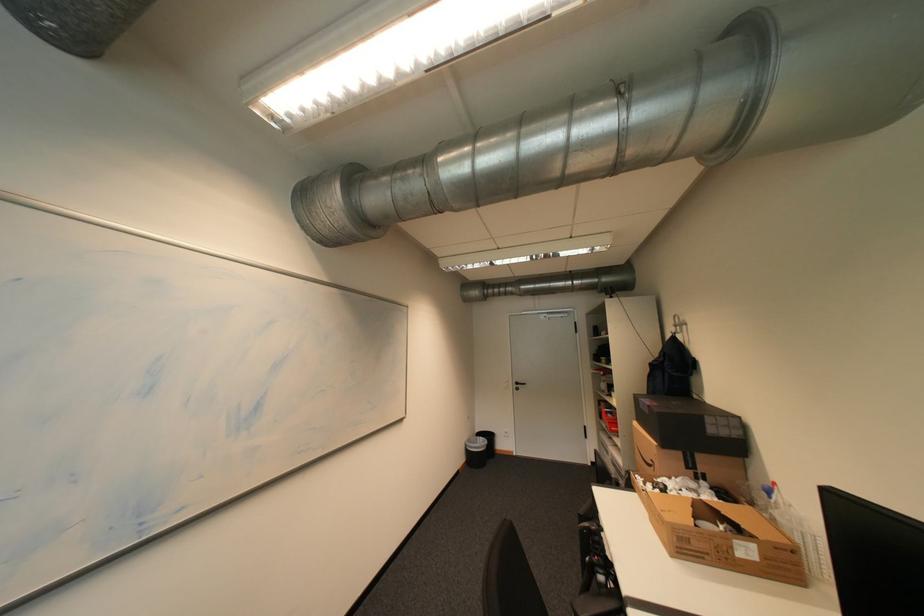
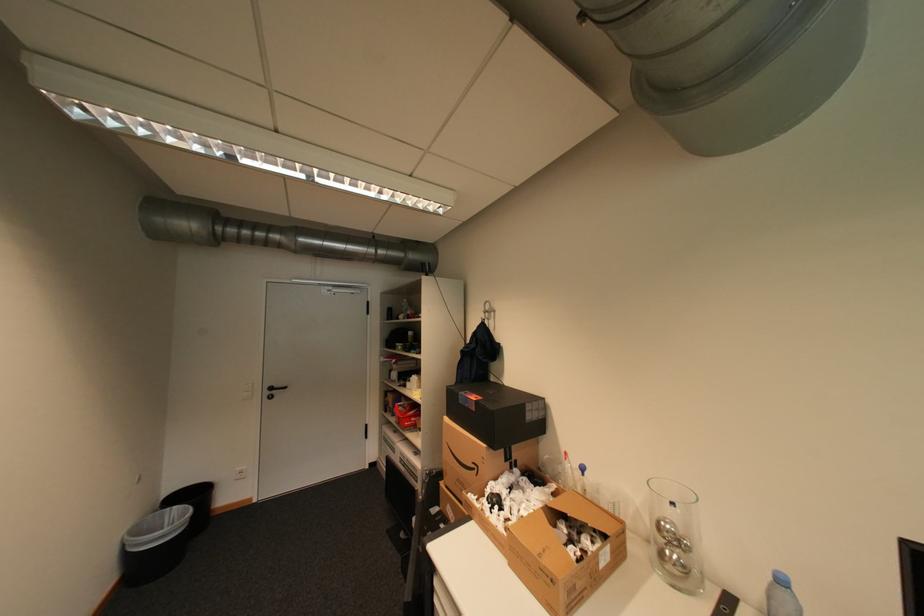
Locate, in the second image, the point that corresponds to [662,464] in the first image.

(484, 468)